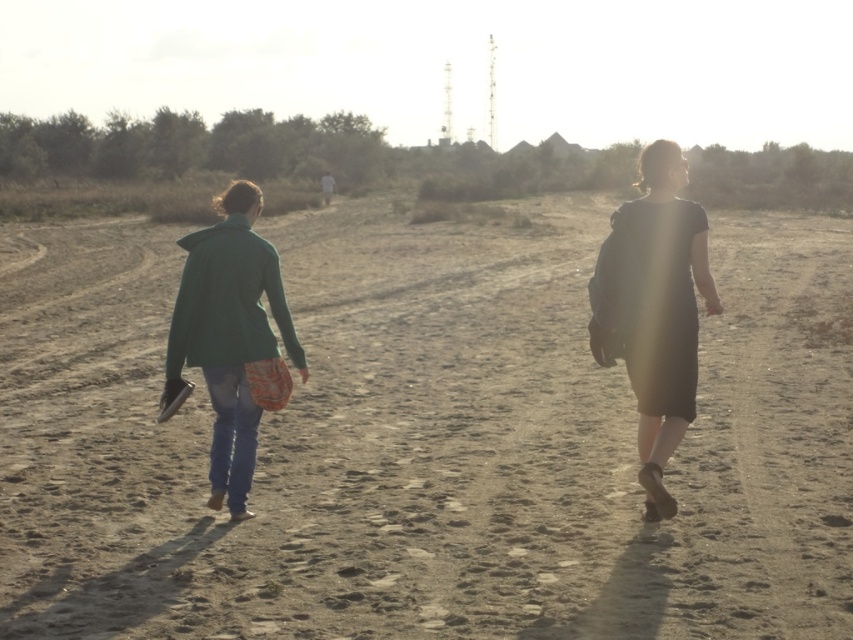
You are a photographer trying to capture the two people walking along the path. You want to ensure that the brown sandy dirt at center and the matte black dress at right are both clearly visible in your shot. Based on their positions, which object should you focus on first to ensure both are in focus?

The brown sandy dirt at center is positioned on the right side of matte black dress at right, so you should focus on the matte black dress at right first since it is closer to the camera. This will ensure both objects are in focus as the sandy dirt is behind it.